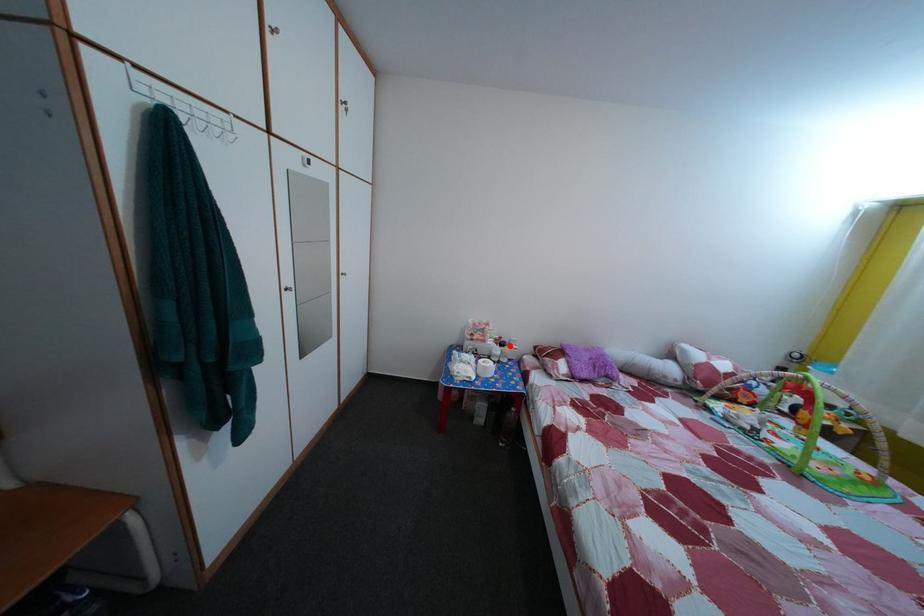
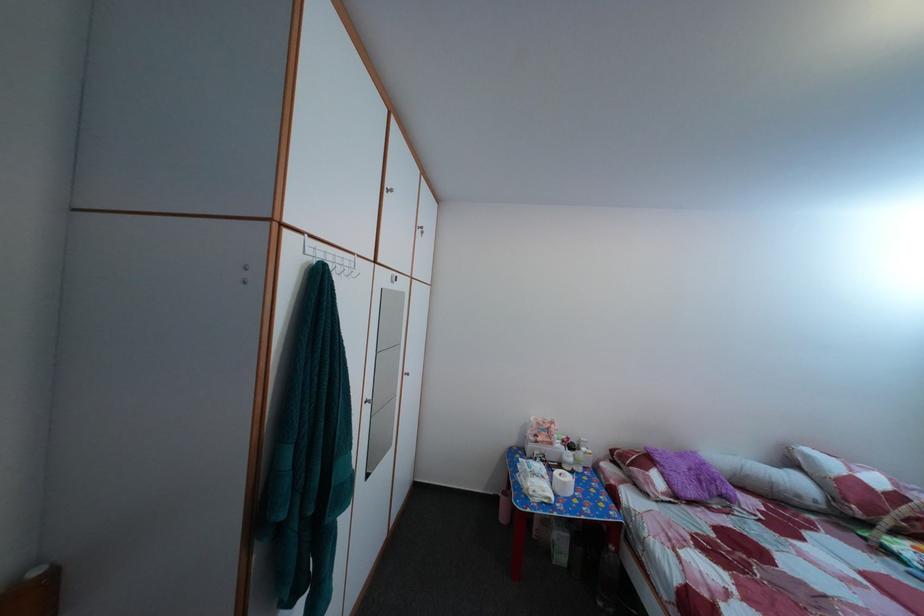
Find the pixel in the second image that matches the highlighted location in the first image.

(578, 447)